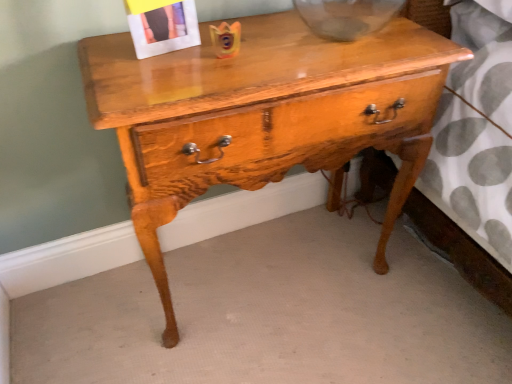
At what (x,y) coordinates should I click in order to perform the action: click on free area below glossy wood nightstand at center (from a real-world perspective). Please return your answer as a coordinate pair (x, y). Looking at the image, I should click on (266, 266).